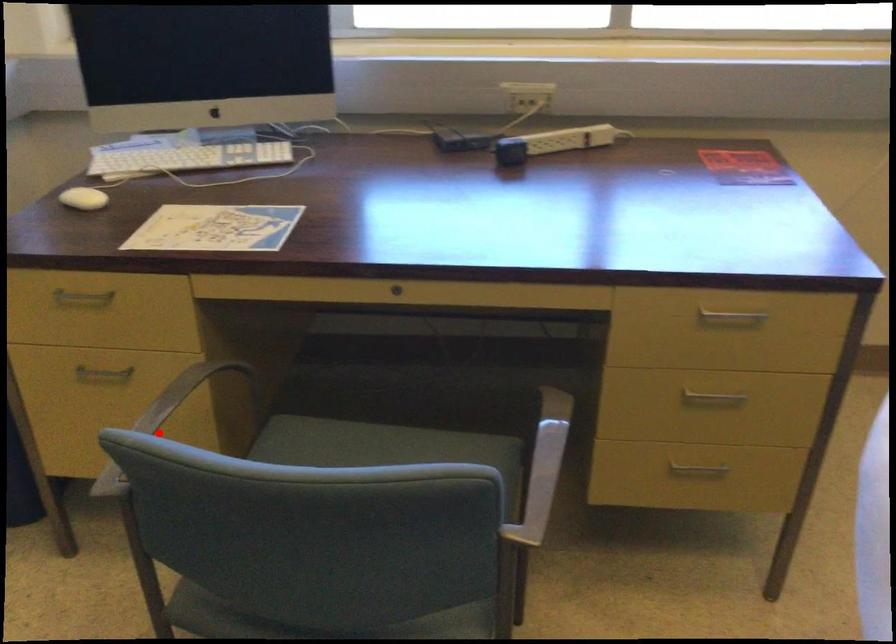
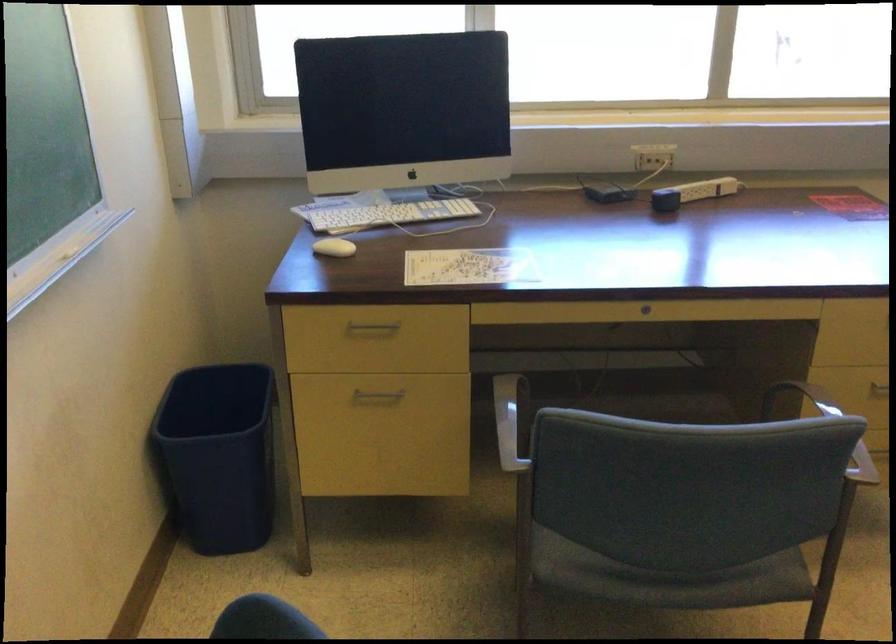
The point at the highlighted location is marked in the first image. Where is the corresponding point in the second image?

(511, 421)